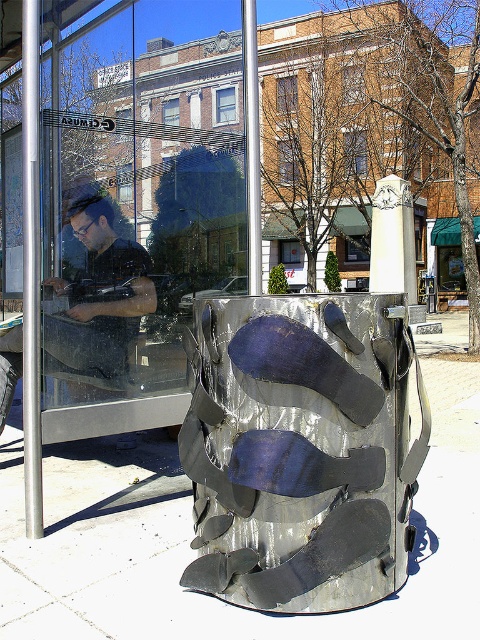
Question: Which is nearer to the matte black shirt at left?

Choices:
 (A) metallic silver sculpture at center
 (B) transparent glass at center

Answer: (B)

Question: Among these objects, which one is farthest from the camera?

Choices:
 (A) matte black shirt at left
 (B) metallic silver sculpture at center
 (C) transparent glass at center

Answer: (A)

Question: Is transparent glass at center positioned behind matte black shirt at left?

Choices:
 (A) no
 (B) yes

Answer: (A)

Question: Which object appears farthest from the camera in this image?

Choices:
 (A) matte black shirt at left
 (B) transparent glass at center

Answer: (A)

Question: Does transparent glass at center have a lesser width compared to metallic silver sculpture at center?

Choices:
 (A) no
 (B) yes

Answer: (A)

Question: Is metallic silver sculpture at center to the right of matte black shirt at left from the viewer's perspective?

Choices:
 (A) no
 (B) yes

Answer: (B)